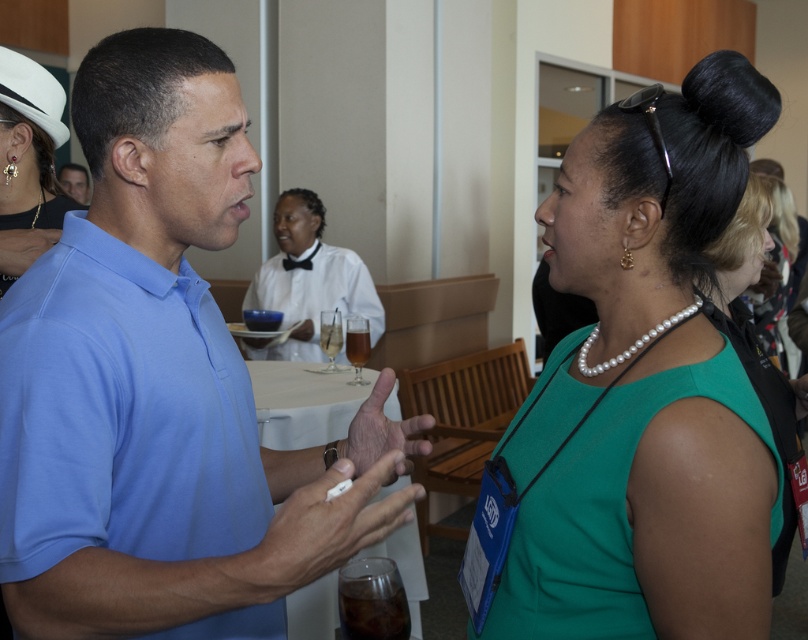
You are standing at the point labeled as point (83, 588) and want to take a photo of the scene. The camera you have can focus on objects within 40 inches. Will the camera be able to capture the entire scene clearly?

The distance between point (83, 588) and the camera is 37.08 inches, which is within the 40 inches focus range. Therefore, the camera can capture the entire scene clearly.

You are an event planner observing the scene. You need to ensure that all accessories are visible to photographers. Considering the positions of the blue smooth shirt at left and pearl earrings at upper left, which one is taller and might be more visible in photos?

The blue smooth shirt at left is taller than the pearl earrings at upper left, so it might be more visible in photos.